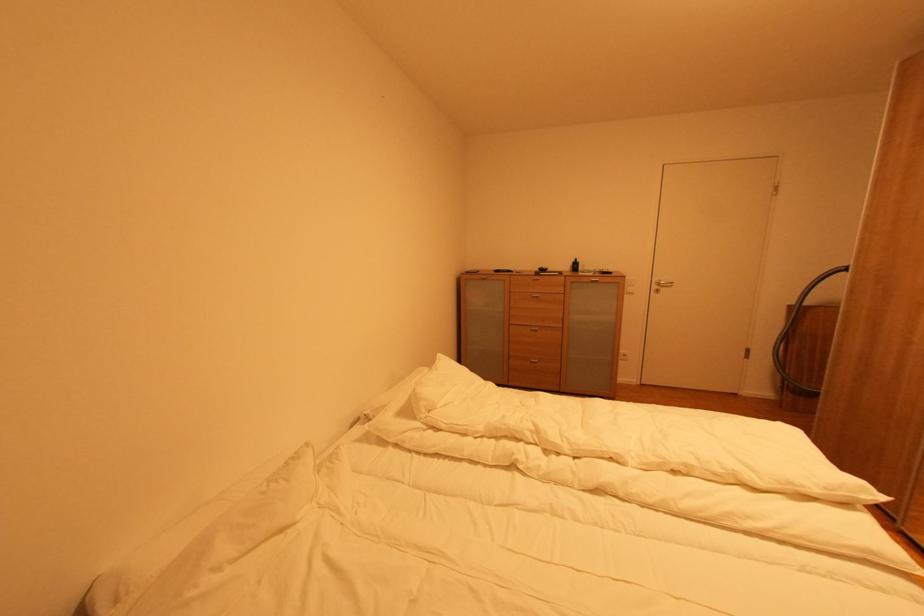
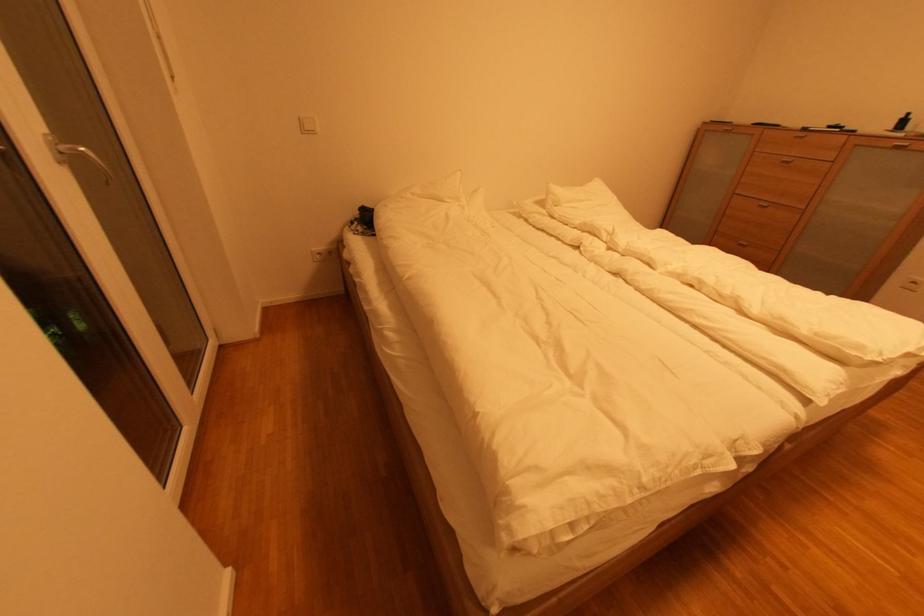
The point at (579, 262) is marked in the first image. Where is the corresponding point in the second image?

(908, 118)